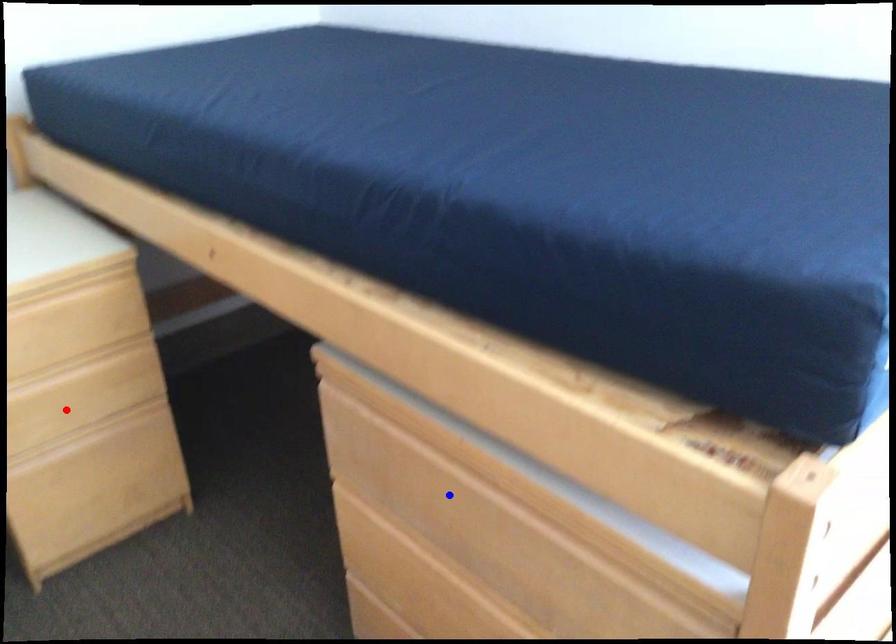
Question: Two points are marked on the image. Which point is closer to the camera?

Choices:
 (A) Blue point is closer.
 (B) Red point is closer.

Answer: (A)